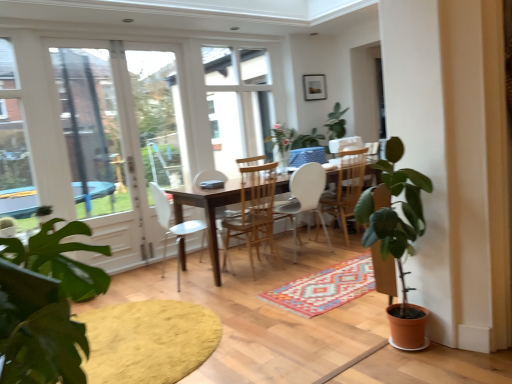
Question: Is clear glass screen door at left bigger or smaller than white plastic chair at center, the 4th chair in the right-to-left sequence?

Choices:
 (A) small
 (B) big

Answer: (A)

Question: From a real-world perspective, is clear glass screen door at left positioned above or below white plastic chair at center, the 4th chair in the right-to-left sequence?

Choices:
 (A) below
 (B) above

Answer: (B)

Question: Estimate the real-world distances between objects in this image. Which object is closer to the clear glass screen door at left?

Choices:
 (A) multicolored woven rug at center
 (B) yellow textured rug at lower left
 (C) yellow felt mat at lower center
 (D) white matte chair at center, acting as the 4th chair starting from the left
 (E) terracotta pot plant at right

Answer: (B)

Question: Which of these objects is positioned farthest from the yellow textured rug at lower left?

Choices:
 (A) clear glass screen door at left
 (B) white matte chair at center, which is counted as the 1th chair, starting from the right
 (C) wooden chair at center, the 3th chair when ordered from right to left
 (D) yellow felt mat at lower center
 (E) terracotta pot plant at right

Answer: (A)